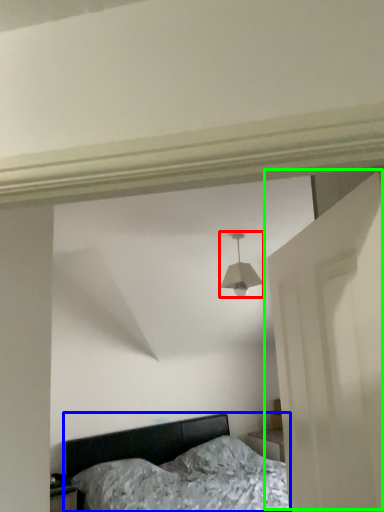
Question: Considering the real-world distances, which object is closest to lamp (highlighted by a red box)? bed (highlighted by a blue box) or door (highlighted by a green box).

Choices:
 (A) bed
 (B) door

Answer: (B)